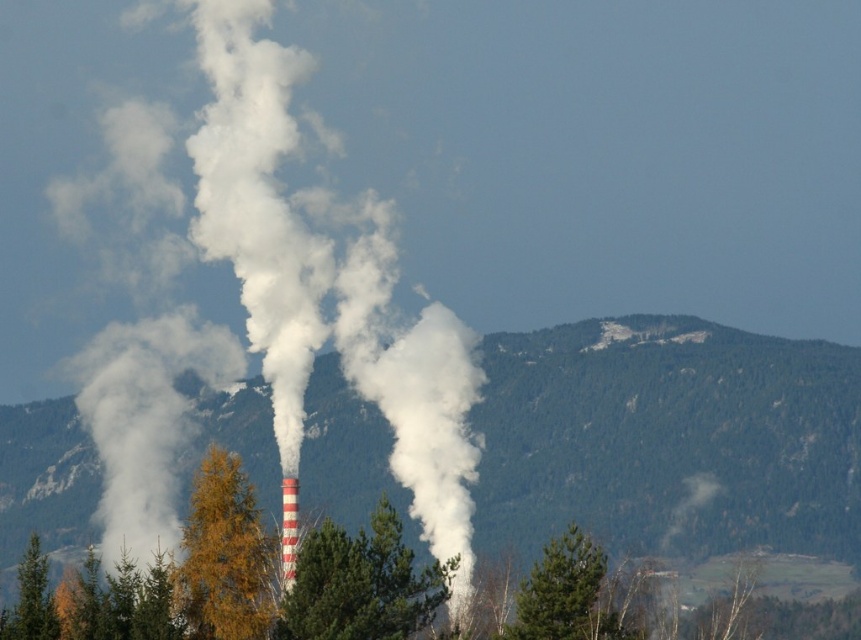
You are standing at the base of the industrial chimney and want to reach the point marked at coordinates point (420, 600). Given that the distance between you and this point is 1388.25 feet, can you estimate how far you need to walk to reach it?

The distance between you and the point (420, 600) is 1388.25 feet, so you need to walk approximately 1388.25 feet to reach it.

You are a drone operator planning to fly a drone from the yellow leafy tree at center to the industrial chimney in the scene. The drone has a maximum range of 400 meters. Can you safely complete the flight without needing to recharge?

The distance between the yellow leafy tree at center and the industrial chimney is 396.37 meters, which is within the drone operator maximum range of 400 meters. The flight can be completed safely without needing to recharge.

You are an environmental scientist observing the scene. You notice the green forested mountain at center and the green matte tree at center. Which of these two is closer to your current position?

The green matte tree at center is closer to you because the green forested mountain at center is further away.